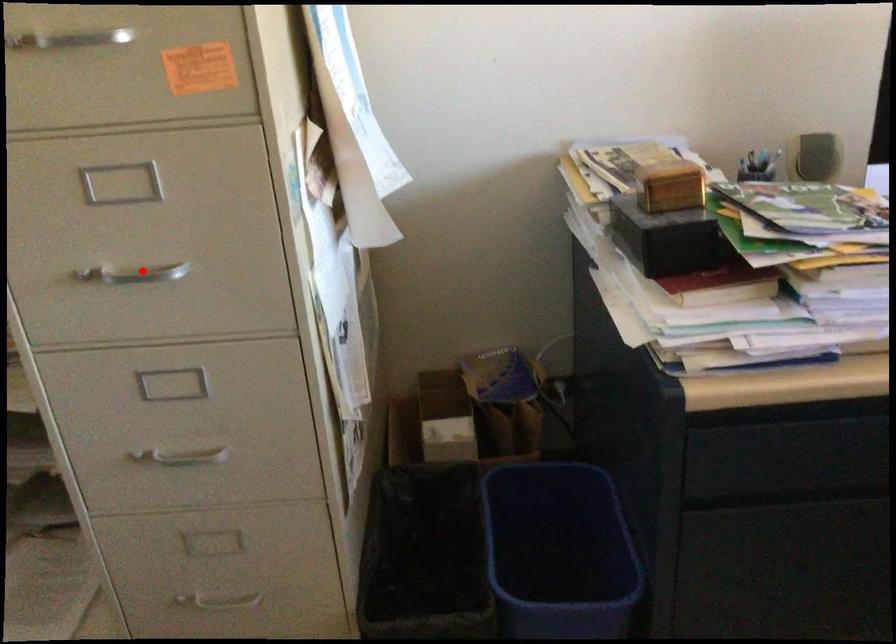
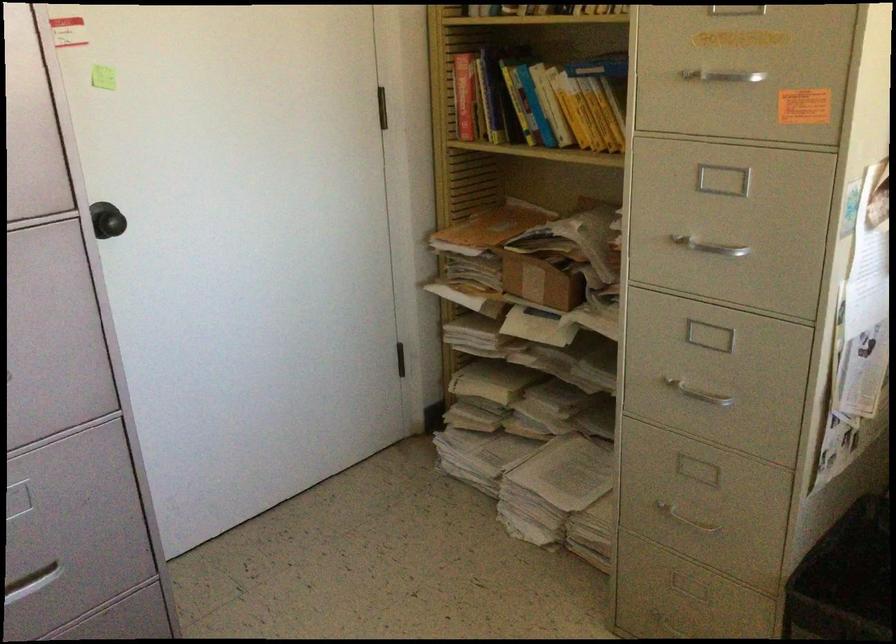
Question: I am providing you with two images of the same scene from different viewpoints. Given a red point in image1, look at the same physical point in image2. Is it:

Choices:
 (A) Closer to the viewpoint
 (B) Farther from the viewpoint

Answer: (B)